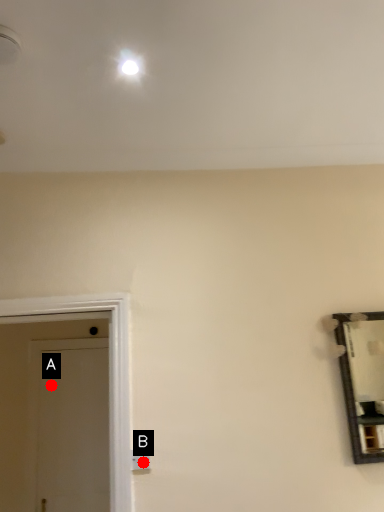
Question: Two points are circled on the image, labeled by A and B beside each circle. Which of the following is the farthest from the observer?

Choices:
 (A) A is further
 (B) B is further

Answer: (A)